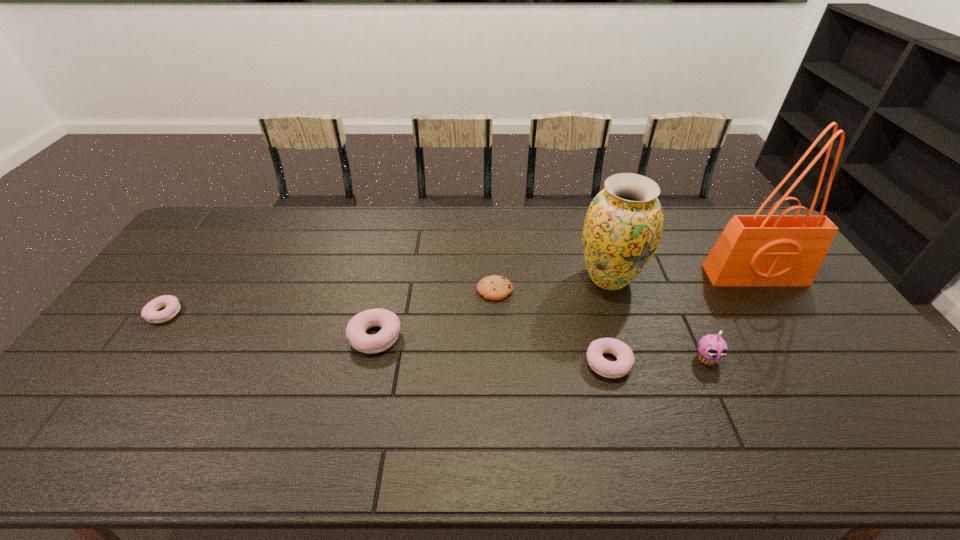
The image size is (960, 540). I want to click on object positioned at the left edge, so click(151, 313).

Identify the location of object that is at the right edge. This screenshot has height=540, width=960. (769, 250).

Image resolution: width=960 pixels, height=540 pixels. I want to click on vacant space at the far edge of the desktop, so click(387, 239).

Identify the location of vacant space at the near edge of the desktop. (396, 397).

Image resolution: width=960 pixels, height=540 pixels. In order to click on vacant area at the left edge of the desktop in this screenshot , I will do `click(194, 247)`.

I want to click on vacant area at the right edge, so click(849, 381).

In the image, there is a desktop. Find the location of `vacant space at the far left corner`. vacant space at the far left corner is located at coordinates (239, 221).

This screenshot has height=540, width=960. I want to click on vacant region at the near left corner of the desktop, so click(x=100, y=417).

In the image, there is a desktop. In order to click on vacant area at the near right corner in this screenshot , I will do `click(839, 397)`.

Identify the location of vacant region between the rightmost doughnut and the third tallest object. The image size is (960, 540). (658, 360).